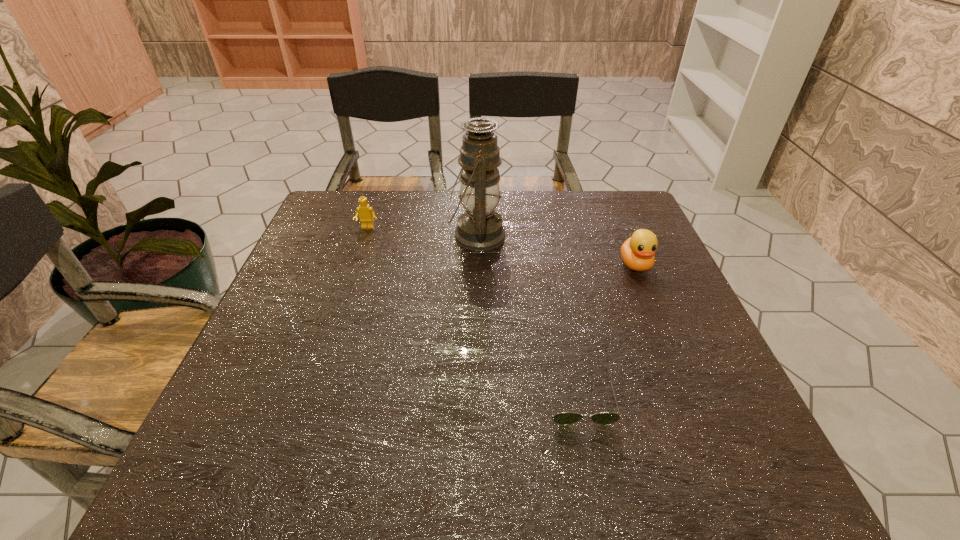
Locate an element on the screen. This screenshot has width=960, height=540. the third object from right to left is located at coordinates 480,228.

Find the location of a particular element. Image resolution: width=960 pixels, height=540 pixels. oil lamp is located at coordinates (480, 228).

Find the location of a particular element. This screenshot has height=540, width=960. duckling is located at coordinates (637, 252).

Locate an element on the screen. Lego is located at coordinates (366, 213).

Find the location of a particular element. the nearest object is located at coordinates (565, 418).

Where is `the second object from right to left`? The width and height of the screenshot is (960, 540). the second object from right to left is located at coordinates (565, 418).

This screenshot has height=540, width=960. What are the coordinates of `free space located on the left of the oil lamp` in the screenshot? It's located at (308, 236).

The height and width of the screenshot is (540, 960). Find the location of `vacant region located 0.160m on the face of the rightmost object`. vacant region located 0.160m on the face of the rightmost object is located at coordinates (661, 327).

This screenshot has width=960, height=540. Identify the location of free space located 0.340m on the face of the Lego. (337, 319).

Where is `vacant region located on the front-facing side of the sunglasses`? vacant region located on the front-facing side of the sunglasses is located at coordinates (595, 482).